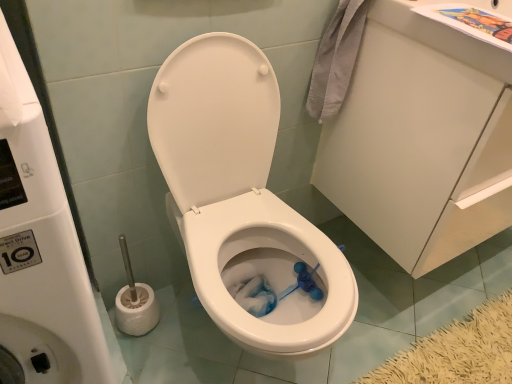
At what (x,y) coordinates should I click in order to perform the action: click on white glossy cabinet at upper right. Please return your answer as a coordinate pair (x, y). Looking at the image, I should click on click(x=422, y=138).

Identify the location of white glossy water tank at upper center. (41, 251).

Is white glossy water tank at upper center positioned with its back to white glossy cabinet at upper right?

No, white glossy water tank at upper center is not facing away from white glossy cabinet at upper right.

Is point (31, 163) positioned after point (373, 56)?

That is False.

From a real-world perspective, does white glossy water tank at upper center stand above white glossy cabinet at upper right?

No, from a real-world perspective, white glossy water tank at upper center is not over white glossy cabinet at upper right

From the image's perspective, which object appears higher, white glossy water tank at upper center or white glossy cabinet at upper right?

white glossy cabinet at upper right.

From the image's perspective, which object appears higher, white glossy water tank at upper center or white glossy toilet at center?

From the image's view, white glossy toilet at center is above.

Which is nearer, (x=26, y=160) or (x=352, y=297)?

Clearly, point (x=26, y=160) is closer to the camera than point (x=352, y=297).

From a real-world perspective, is white glossy water tank at upper center positioned over white glossy toilet at center based on gravity?

Indeed, from a real-world perspective, white glossy water tank at upper center stands above white glossy toilet at center.

Between white glossy water tank at upper center and white glossy toilet at center, which one is positioned in front?

white glossy water tank at upper center.

From a real-world perspective, is white glossy cabinet at upper right located beneath white glossy toilet at center?

Incorrect, from a real-world perspective, white glossy cabinet at upper right is higher than white glossy toilet at center.

Does point (451, 73) appear closer or farther from the camera than point (231, 320)?

Point (451, 73) appears to be farther away from the viewer than point (231, 320).

From the image's perspective, does white glossy cabinet at upper right appear higher than white glossy toilet at center?

Yes, from the image's perspective, white glossy cabinet at upper right is on top of white glossy toilet at center.

Between white glossy toilet at center and white glossy water tank at upper center, which one is positioned behind?

white glossy toilet at center is further away from the camera.

From the image's perspective, is white glossy toilet at center located beneath white glossy water tank at upper center?

Actually, white glossy toilet at center appears above white glossy water tank at upper center in the image.

From the picture: Is white glossy toilet at center far away from white glossy water tank at upper center?

white glossy toilet at center is near white glossy water tank at upper center, not far away.

Find the location of a particular element. water tank in front of the white glossy toilet at center is located at coordinates (41, 251).

Is point (337, 267) positioned after point (413, 121)?

That is False.

Which object is positioned more to the right, white glossy toilet at center or white glossy cabinet at upper right?

white glossy cabinet at upper right.

From the image's perspective, does white glossy toilet at center appear higher than white glossy cabinet at upper right?

No, from the image's perspective, white glossy toilet at center is not over white glossy cabinet at upper right.

How many degrees apart are the facing directions of white glossy toilet at center and white glossy cabinet at upper right?

They differ by 1.21e-05 degrees in their facing directions.

From the image's perspective, which one is positioned higher, white glossy cabinet at upper right or white glossy water tank at upper center?

white glossy cabinet at upper right appears higher in the image.

Is white glossy cabinet at upper right not inside white glossy water tank at upper center?

Yes, white glossy cabinet at upper right is not within white glossy water tank at upper center.

Is white glossy cabinet at upper right facing towards white glossy water tank at upper center?

No, white glossy cabinet at upper right is not oriented towards white glossy water tank at upper center.

Find the location of a particular element. This screenshot has width=512, height=384. water tank on the left of white glossy cabinet at upper right is located at coordinates (41, 251).

The image size is (512, 384). What are the coordinates of `water tank that is below the white glossy cabinet at upper right (from the image's perspective)` in the screenshot? It's located at (41, 251).

In order to click on toilet on the right of white glossy water tank at upper center in this screenshot , I will do `click(241, 196)`.

When comparing their distances from white glossy toilet at center, does white glossy cabinet at upper right or white glossy water tank at upper center seem further?

Among the two, white glossy water tank at upper center is located further to white glossy toilet at center.

Estimate the real-world distances between objects in this image. Which object is closer to white glossy cabinet at upper right, white glossy water tank at upper center or white glossy toilet at center?

white glossy toilet at center is closer to white glossy cabinet at upper right.

Based on their spatial positions, is white glossy water tank at upper center or white glossy cabinet at upper right further from white glossy toilet at center?

Among the two, white glossy water tank at upper center is located further to white glossy toilet at center.

Which object lies further to the anchor point white glossy cabinet at upper right, white glossy toilet at center or white glossy water tank at upper center?

The object further to white glossy cabinet at upper right is white glossy water tank at upper center.

Which object lies further to the anchor point white glossy water tank at upper center, white glossy toilet at center or white glossy cabinet at upper right?

Among the two, white glossy cabinet at upper right is located further to white glossy water tank at upper center.

Estimate the real-world distances between objects in this image. Which object is closer to white glossy water tank at upper center, white glossy cabinet at upper right or white glossy toilet at center?

The object closer to white glossy water tank at upper center is white glossy toilet at center.

Locate an element on the screen. This screenshot has height=384, width=512. toilet between white glossy water tank at upper center and white glossy cabinet at upper right in the horizontal direction is located at coordinates (241, 196).